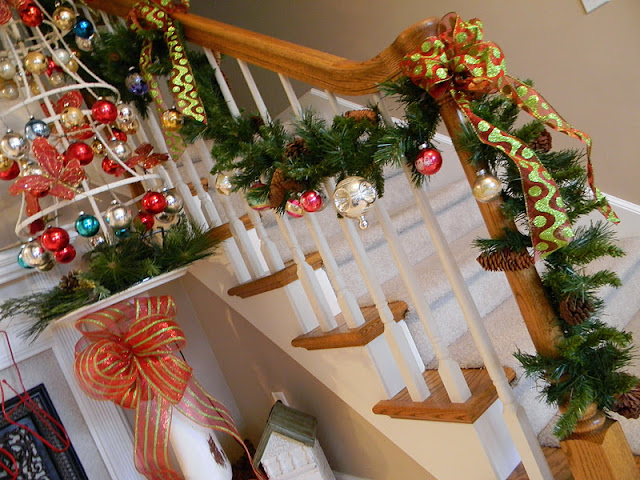
You are a GUI agent. You are given a task and a screenshot of the screen. Output one action in this format:
    pyautogui.click(x=<x>, y=<y>)
    Task: Click on the wooden step
    The image size is (640, 480).
    Given the screenshot: What is the action you would take?
    pyautogui.click(x=473, y=404)